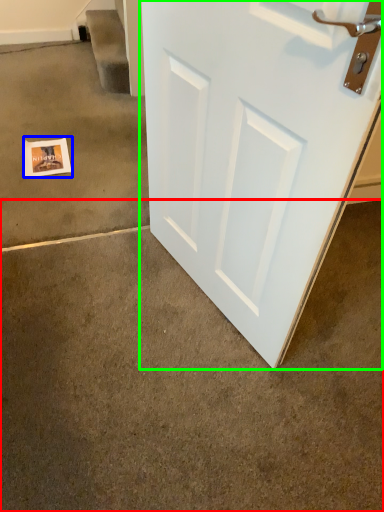
Question: Which object is positioned farthest from concrete (highlighted by a red box)? Select from postcard (highlighted by a blue box) and door (highlighted by a green box).

Choices:
 (A) postcard
 (B) door

Answer: (A)